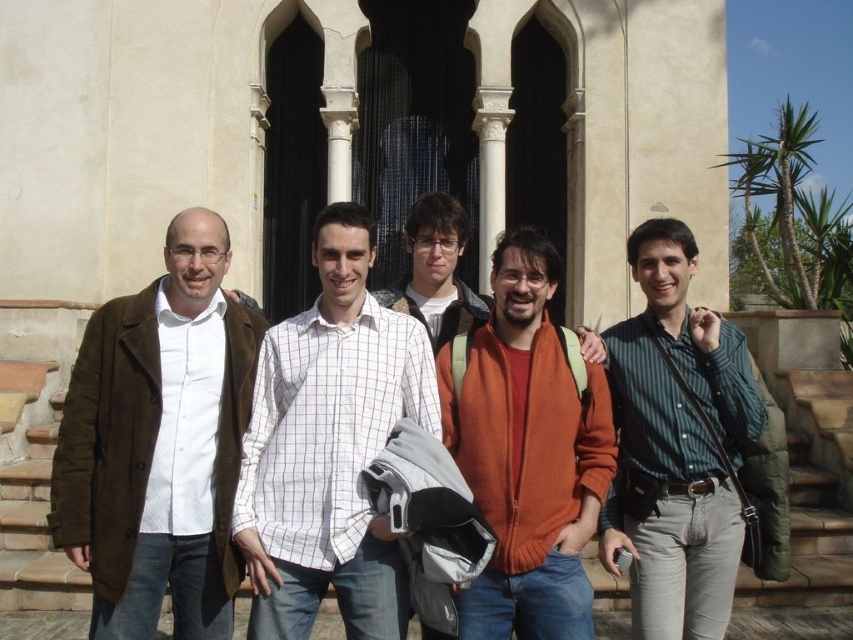
You are a photographer trying to capture the group of people in front of the building. The white checkered shirt at center and the brown stone stairs at lower left are both in your view. Which object takes up more space in the photo?

The brown stone stairs at lower left take up more space in the photo because the white checkered shirt at center occupies less space than brown stone stairs at lower left.

You are trying to decide which item to grab quickly from the center of the image. The white checkered shirt at center and the orange fleece jacket at center are both within reach. Based on their sizes, which one would you choose to take if you need something wider?

The white checkered shirt at center might be wider than orange fleece jacket at center, so you should choose the white checkered shirt at center.